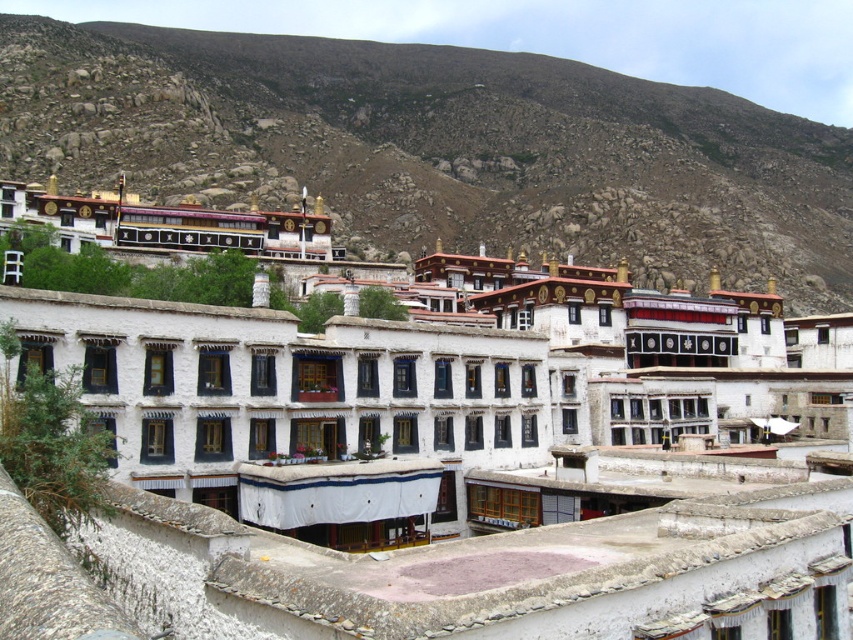
Question: Is white stone building at center thinner than brown rocky hillside at upper center?

Choices:
 (A) no
 (B) yes

Answer: (B)

Question: Where is white stone building at center located in relation to brown rocky hillside at upper center in the image?

Choices:
 (A) left
 (B) right

Answer: (A)

Question: Is white stone building at center in front of brown rocky hillside at upper center?

Choices:
 (A) yes
 (B) no

Answer: (A)